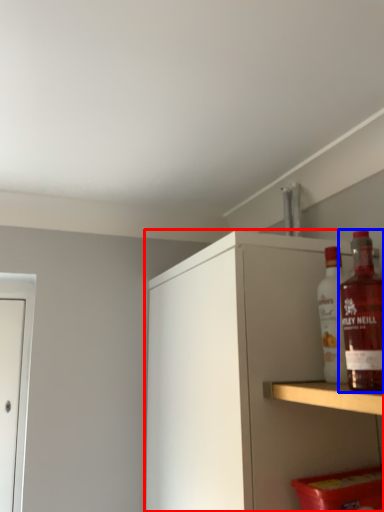
Question: Which of the following is the farthest to the observer, cabinetry (highlighted by a red box) or bottle (highlighted by a blue box)?

Choices:
 (A) cabinetry
 (B) bottle

Answer: (A)